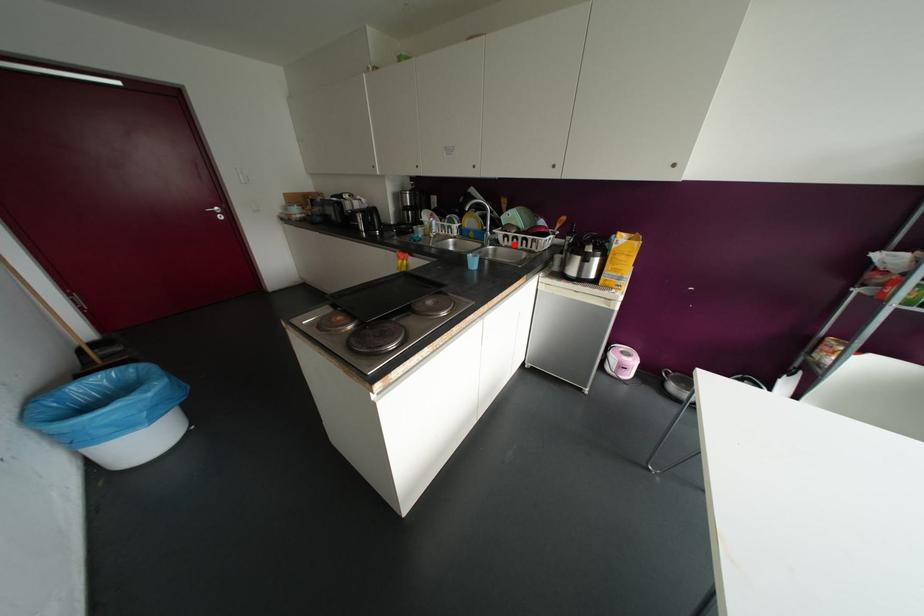
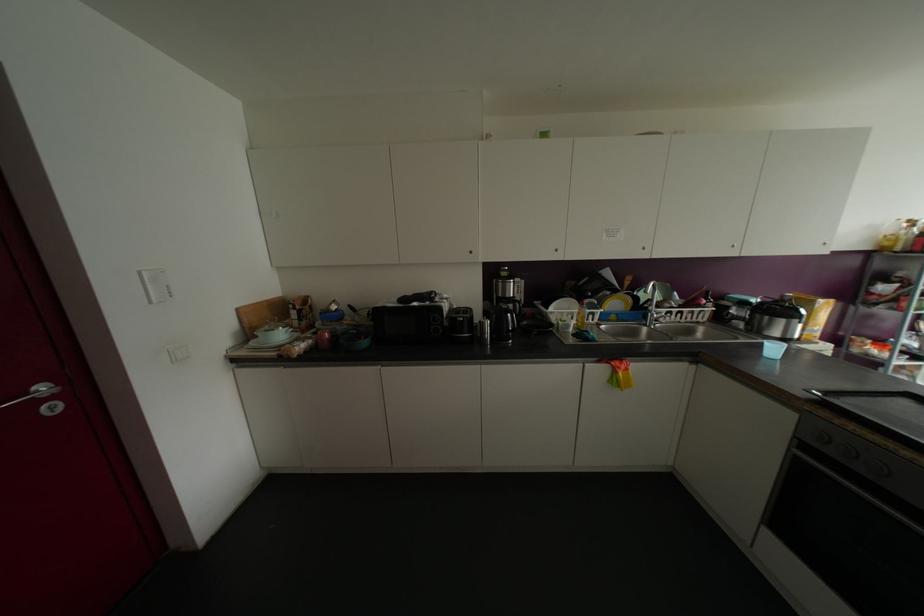
Find the pixel in the second image that matches the highlighted location in the first image.

(677, 318)